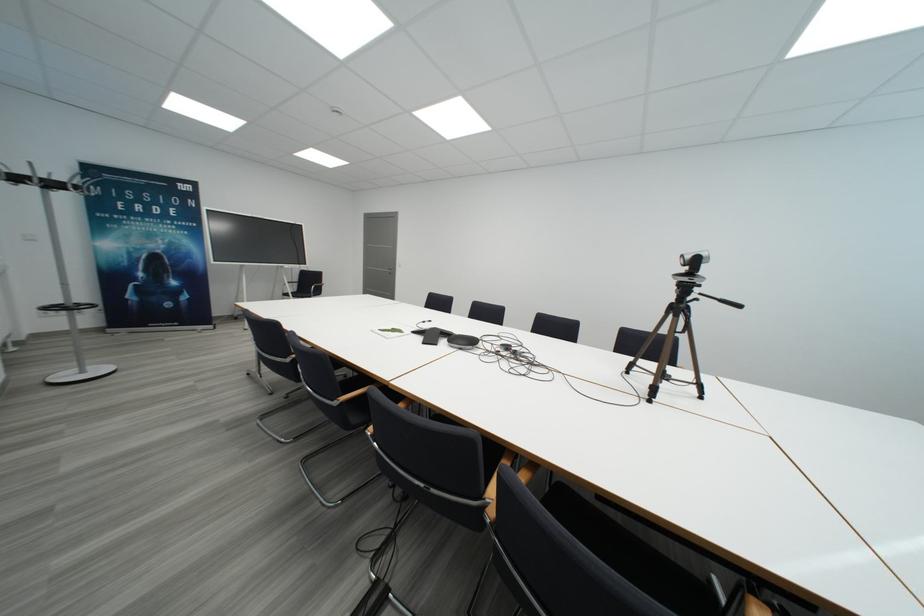
At what (x,y) coordinates should I click in order to perform the action: click on coat stand hook. Please return your answer as a coordinate pair (x, y). Image resolution: width=924 pixels, height=616 pixels. Looking at the image, I should click on (50, 180).